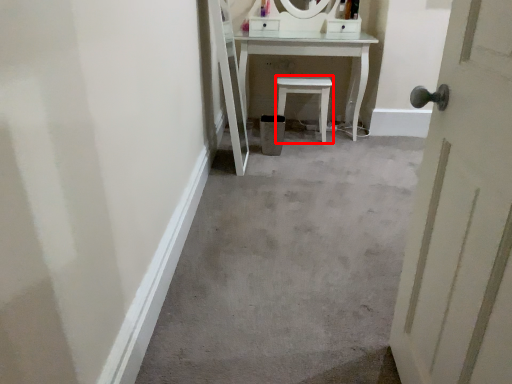
Question: From the image's perspective, what is the correct spatial positioning of furniture (annotated by the red box) in reference to door?

Choices:
 (A) above
 (B) below

Answer: (A)